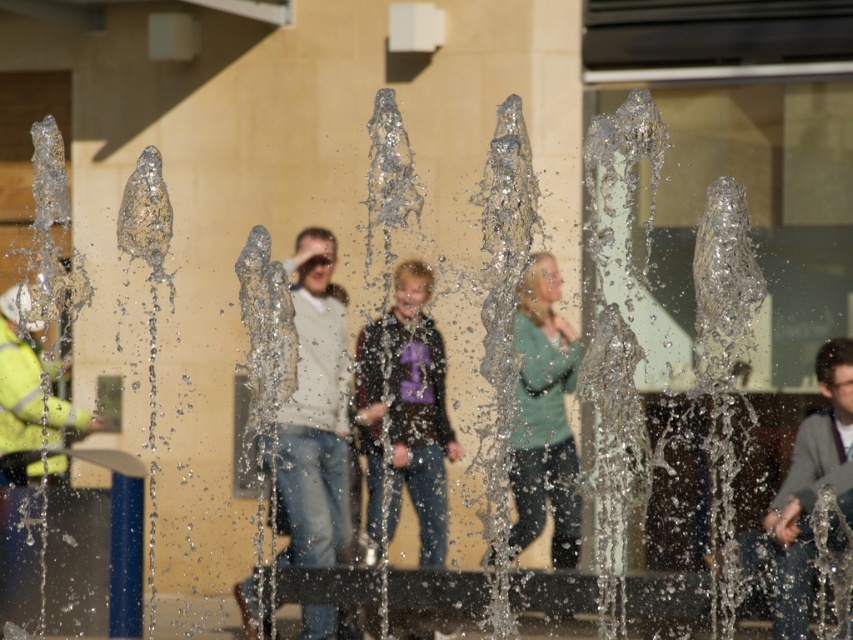
Question: Does teal matte sweater at center have a smaller size compared to high visibility yellow jacket at left?

Choices:
 (A) yes
 (B) no

Answer: (B)

Question: Which point appears closest to the camera in this image?

Choices:
 (A) (30, 344)
 (B) (527, 308)
 (C) (775, 627)

Answer: (C)

Question: Does teal matte sweater at center appear on the right side of gray fabric jacket at lower right?

Choices:
 (A) no
 (B) yes

Answer: (A)

Question: Can you confirm if gray fabric jacket at lower right is positioned to the left of high visibility yellow jacket at left?

Choices:
 (A) no
 (B) yes

Answer: (A)

Question: Which object is closer to the camera taking this photo?

Choices:
 (A) dark purple fabric shirt at center
 (B) matte white sweater at center

Answer: (B)

Question: Among these objects, which one is farthest from the camera?

Choices:
 (A) gray fabric jacket at lower right
 (B) dark purple fabric shirt at center
 (C) high visibility yellow jacket at left
 (D) matte white sweater at center

Answer: (C)